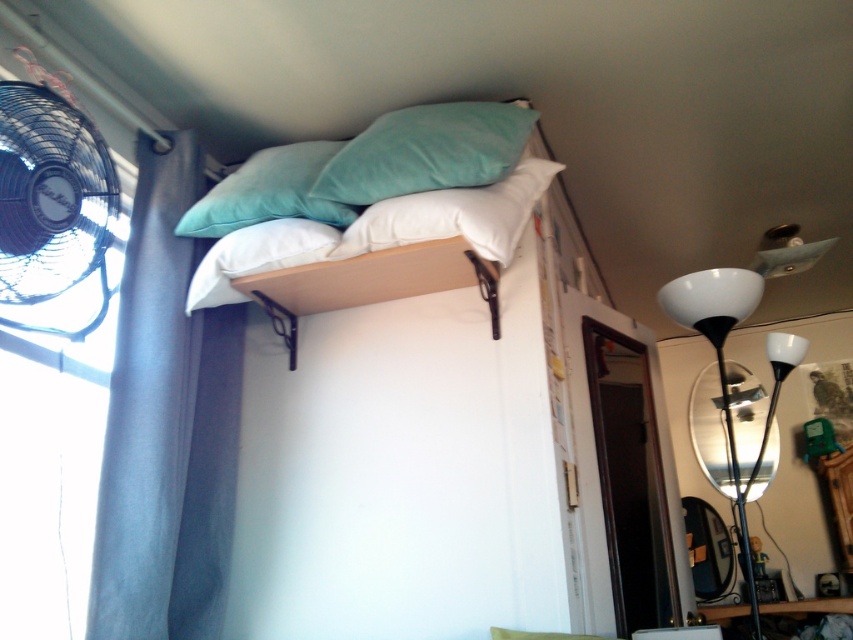
Between point (149, 336) and point (212, 257), which one is positioned in front?

Point (149, 336) is more forward.

Can you confirm if blue fabric curtain at left is positioned to the right of white soft pillow at center?

No, blue fabric curtain at left is not to the right of white soft pillow at center.

Identify the location of blue fabric curtain at left. This screenshot has width=853, height=640. (166, 424).

Is point (370, 148) closer to viewer compared to point (668, 308)?

That is True.

Is teal velvety pillow at upper center shorter than white glossy floor lamp at right?

Yes, teal velvety pillow at upper center is shorter than white glossy floor lamp at right.

The height and width of the screenshot is (640, 853). Describe the element at coordinates (426, 150) in the screenshot. I see `teal velvety pillow at upper center` at that location.

Identify the location of teal velvety pillow at upper center. (426, 150).

Can you confirm if soft cotton pillows at upper center is positioned above soft white pillow at center?

Incorrect, soft cotton pillows at upper center is not positioned above soft white pillow at center.

Between point (456, 196) and point (367, 227), which one is positioned behind?

The point (367, 227) is behind.

Image resolution: width=853 pixels, height=640 pixels. I want to click on soft cotton pillows at upper center, so click(x=369, y=248).